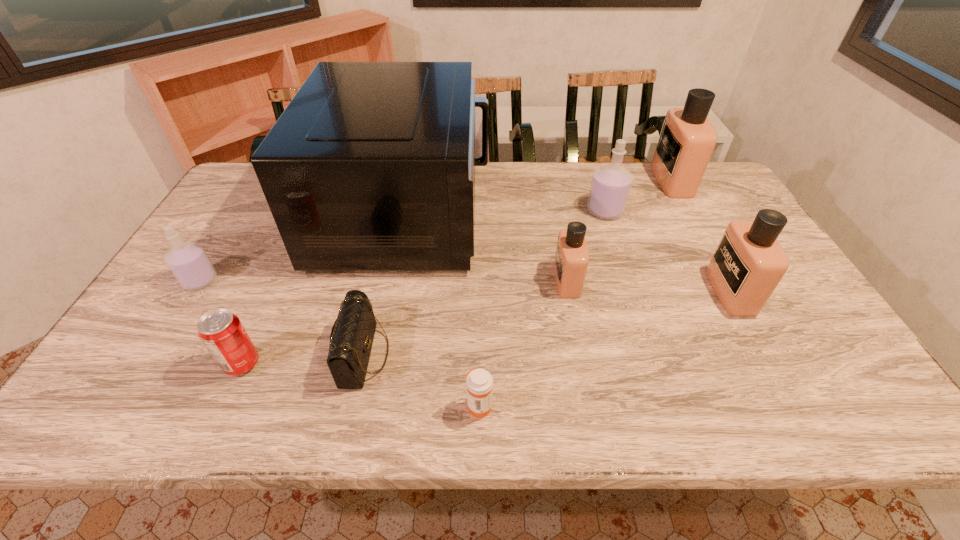
What are the coordinates of `empty location between the orange medicine and the second smallest beige perfume` in the screenshot? It's located at (605, 348).

Locate an element on the screen. blank region between the second biggest beige perfume and the leftmost perfume is located at coordinates (466, 286).

At what (x,y) coordinates should I click in order to perform the action: click on free area in between the nearest object and the second smallest beige perfume. Please return your answer as a coordinate pair (x, y). Looking at the image, I should click on (605, 348).

Identify the location of vacant space that's between the soda and the farther purple perfume. (423, 287).

Where is `vacant point located between the eighth shortest object and the bigger purple perfume`? This screenshot has height=540, width=960. vacant point located between the eighth shortest object and the bigger purple perfume is located at coordinates (638, 195).

Identify the location of free area in between the microwave_oven and the orange medicine. The width and height of the screenshot is (960, 540). (443, 309).

You are a GUI agent. You are given a task and a screenshot of the screen. Output one action in this format:
    pyautogui.click(x=<x>, y=<y>)
    Task: Click on the free spot between the clutch bag and the microwave_oven
    
    Given the screenshot: What is the action you would take?
    pyautogui.click(x=385, y=284)

The height and width of the screenshot is (540, 960). I want to click on free space between the soda and the third perfume from left to right, so click(423, 287).

Locate an element on the screen. object that is the seventh closest to the clutch bag is located at coordinates (749, 262).

Identify which object is the eighth nearest to the farthest perfume. Please provide its 2D coordinates. Your answer should be formatted as a tuple, i.e. [(x, y)], where the tuple contains the x and y coordinates of a point satisfying the conditions above.

[(189, 263)]